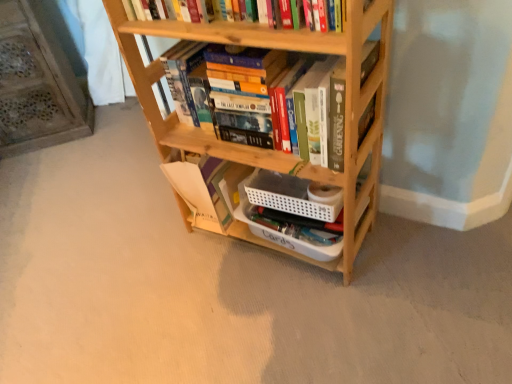
Image resolution: width=512 pixels, height=384 pixels. I want to click on free location in front of wooden bookshelf at left, so click(x=48, y=174).